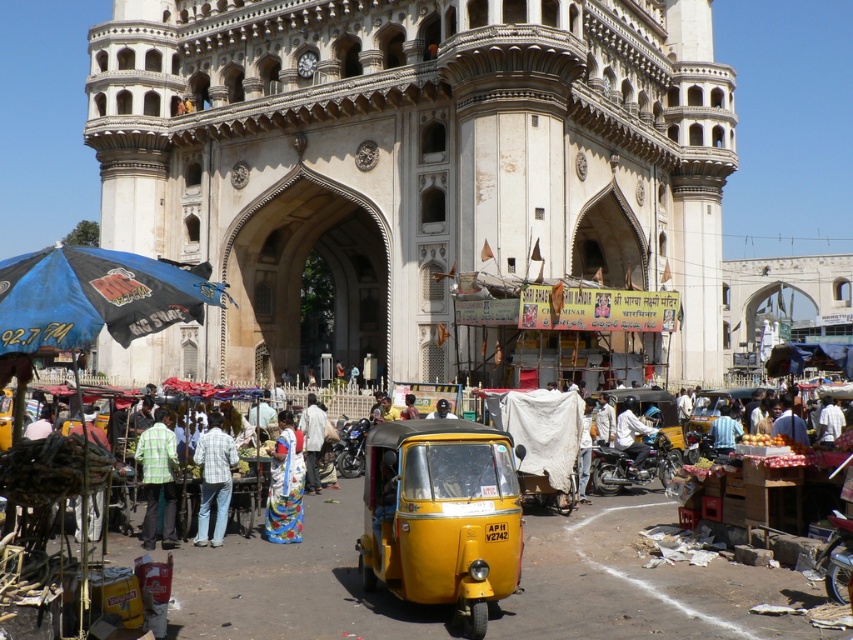
You are a tourist standing in front of the white stone building at center and the white cotton shirt at center. Which object is bigger?

The white stone building at center is larger in size compared to the white cotton shirt at center.

You are standing at the location of the white matte shirt at center and want to take a photo of the white stone building at center. If your camera has a maximum focus range of 30 meters, will you be able to capture the building clearly?

The distance between the white stone building at center and the white matte shirt at center is 33.46 meters. Since the camera can only focus up to 30 meters, you won t be able to capture the building clearly.

Looking at this image, you are a tourist standing in front of the white stone building at center and the white cotton shirt at center. Which object is closer to you?

The white cotton shirt at center is closer to you because the white stone building at center is positioned over it, indicating the shirt is in front.